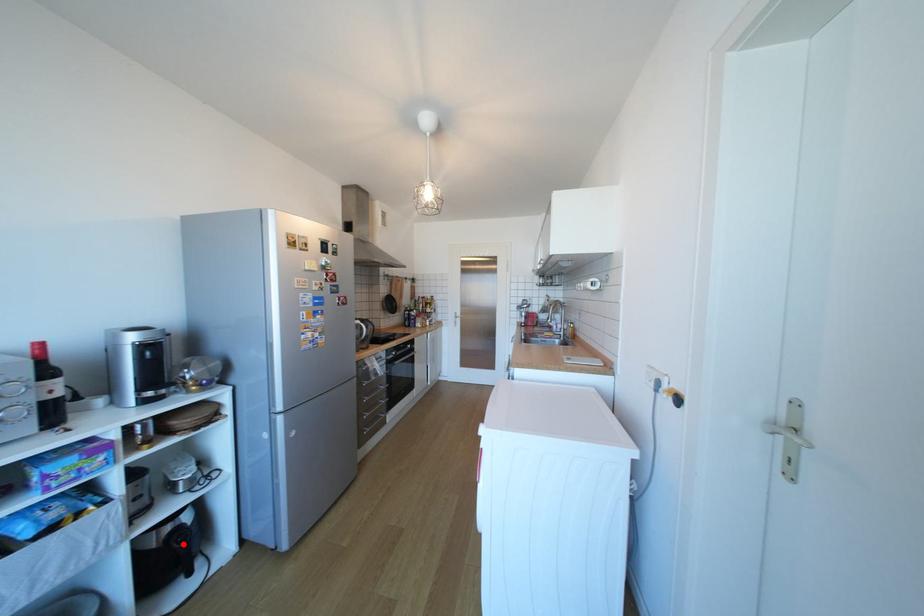
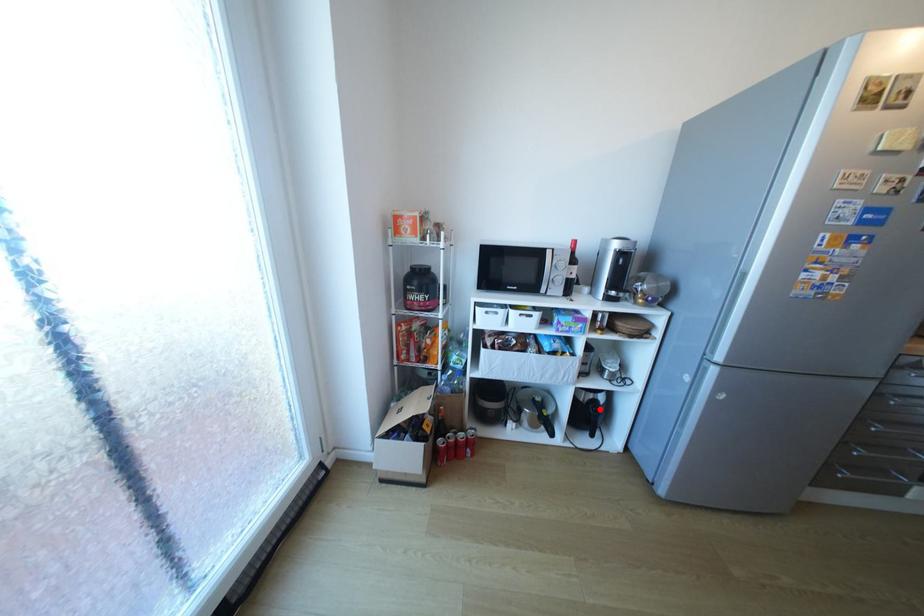
Looking at this image, I am providing you with two images of the same scene from different viewpoints. A red point is marked on the first image and another point is marked on the second image. Is the red point in image1 aligned with the point shown in image2?

Yes